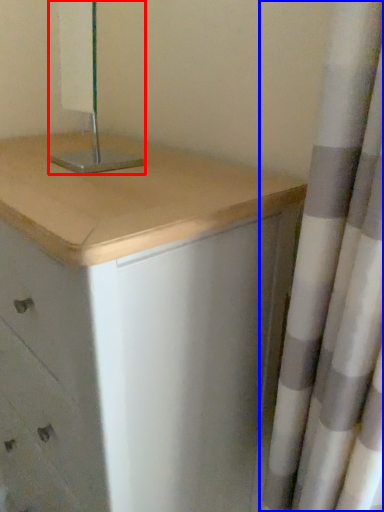
Question: Among these objects, which one is nearest to the camera, bedside lamp (highlighted by a red box) or curtain (highlighted by a blue box)?

Choices:
 (A) bedside lamp
 (B) curtain

Answer: (B)